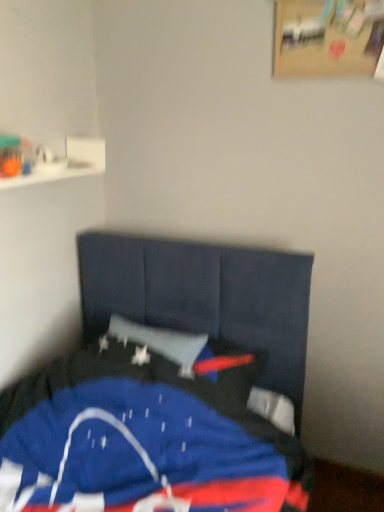
Describe the element at coordinates (163, 389) in the screenshot. This screenshot has height=512, width=384. I see `blue fabric bed at lower left` at that location.

In order to click on blue fabric bed at lower left in this screenshot , I will do `click(163, 389)`.

You are a GUI agent. You are given a task and a screenshot of the screen. Output one action in this format:
    pyautogui.click(x=<x>, y=<y>)
    Task: Click on the blue fabric bed at lower left
    Image resolution: width=384 pixels, height=512 pixels.
    Given the screenshot: What is the action you would take?
    pyautogui.click(x=163, y=389)